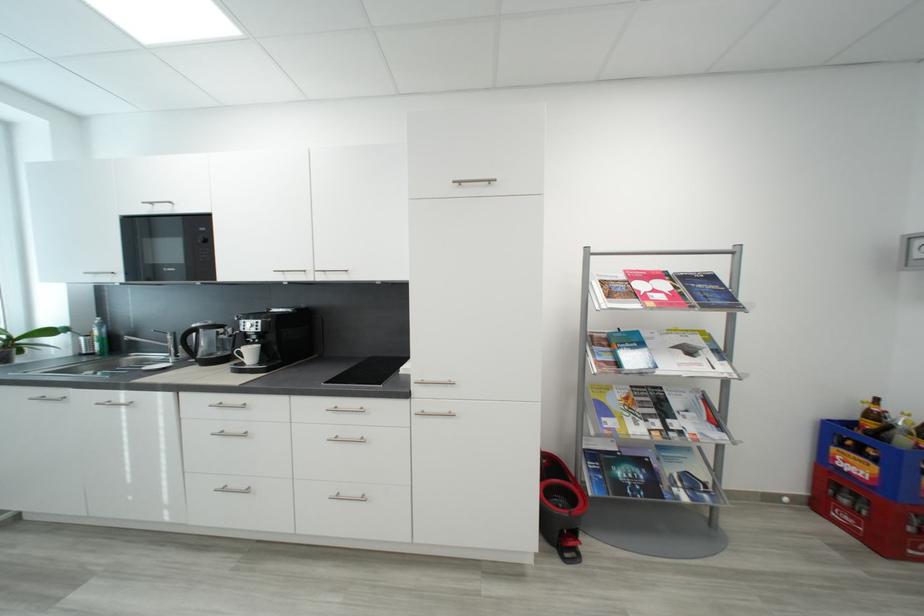
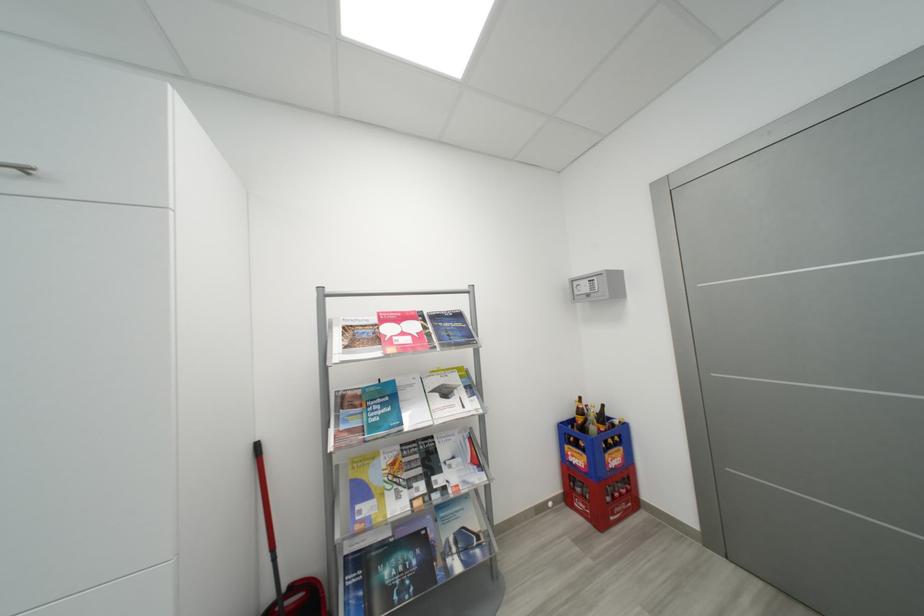
Question: The images are taken continuously from a first-person perspective. In which direction is your viewpoint rotating?

Choices:
 (A) Left
 (B) Right
 (C) Up
 (D) Down

Answer: (B)